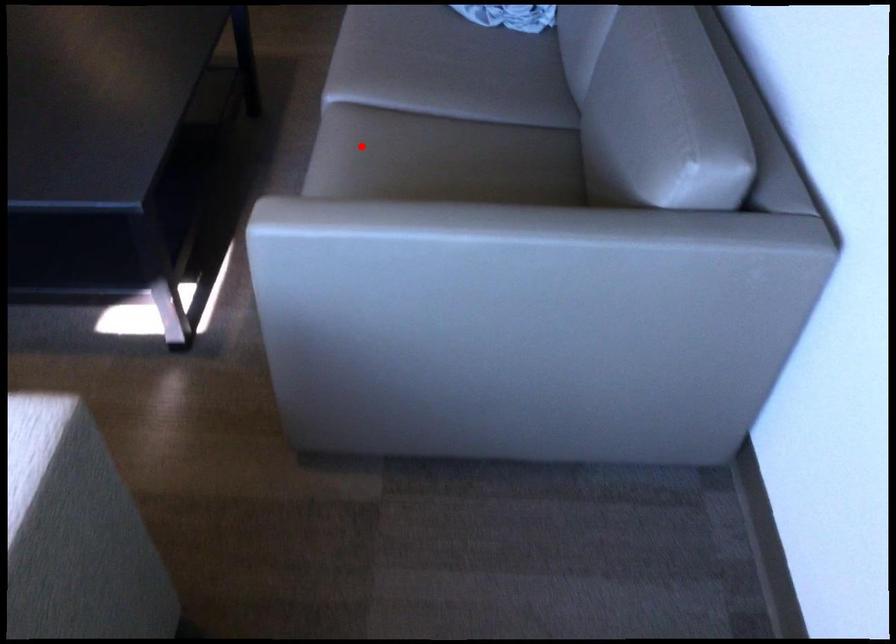
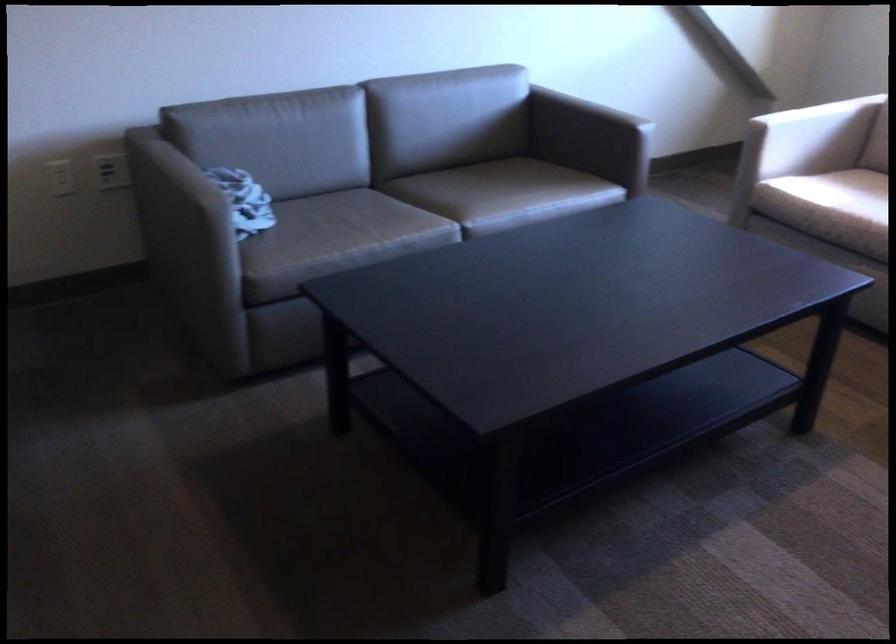
Question: I am providing you with two images of the same scene from different viewpoints. Image1 has a red point marked. In image2, the corresponding 3D location appears at what relative position? Reply with the corresponding letter.

Choices:
 (A) Closer
 (B) Farther

Answer: (B)